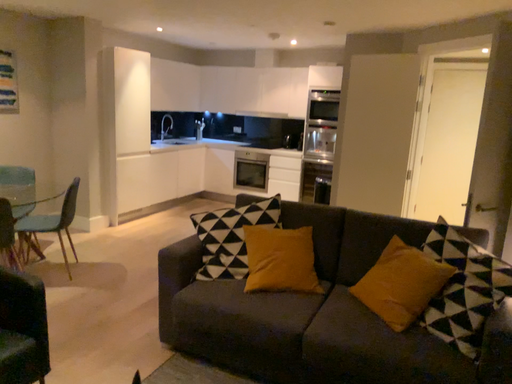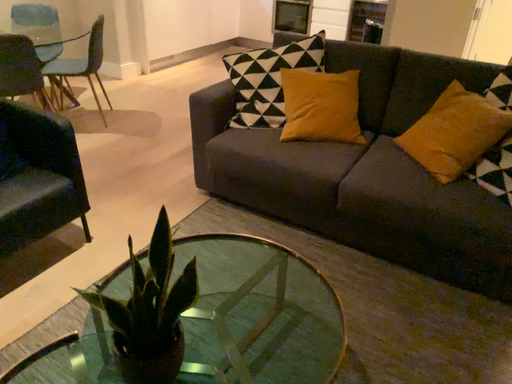
Question: How did the camera likely rotate when shooting the video?

Choices:
 (A) rotated upward
 (B) rotated downward

Answer: (B)